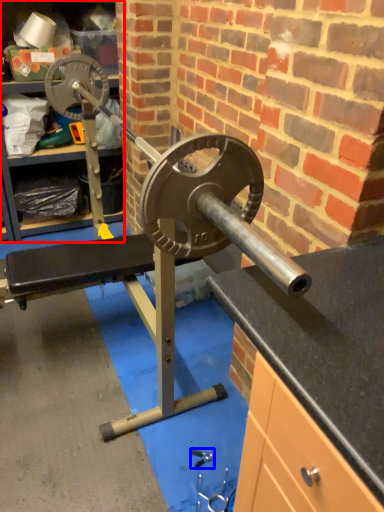
Question: Which point is closer to the camera, cabinet (highlighted by a red box) or tool (highlighted by a blue box)?

Choices:
 (A) cabinet
 (B) tool

Answer: (B)